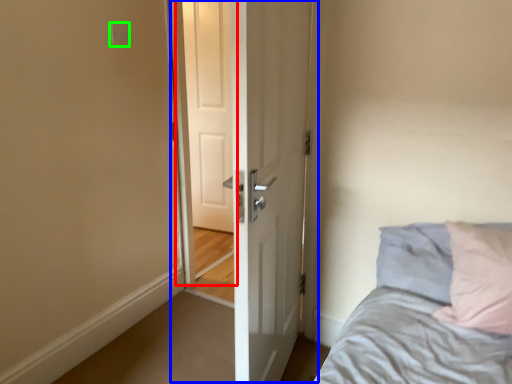
Question: Considering the real-world distances, which object is closest to screen door (highlighted by a red box)? door (highlighted by a blue box) or electric outlet (highlighted by a green box).

Choices:
 (A) door
 (B) electric outlet

Answer: (B)